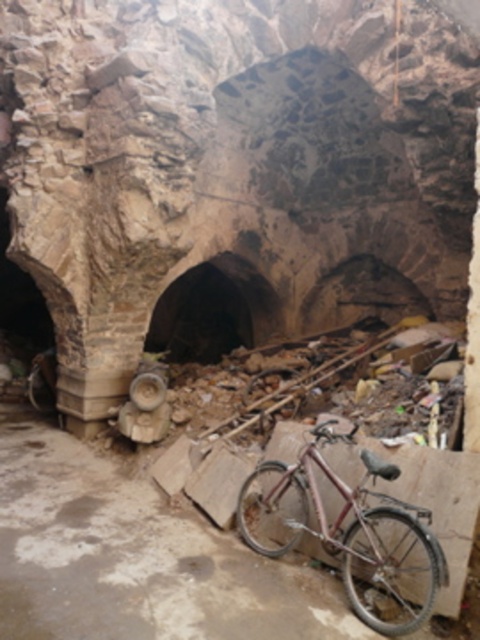
How distant is rusty metal bicycle at center from brown stone tunnel at center?

A distance of 18.81 feet exists between rusty metal bicycle at center and brown stone tunnel at center.

Locate an element on the screen. rusty metal bicycle at center is located at coordinates (136, 557).

Which is in front, point (58, 486) or point (190, 360)?

Point (58, 486) is more forward.

What are the coordinates of `rusty metal bicycle at center` in the screenshot? It's located at (136, 557).

Does rusty metal bicycle at center appear over rusty metallic bicycle at center?

Actually, rusty metal bicycle at center is below rusty metallic bicycle at center.

Can you confirm if rusty metal bicycle at center is positioned to the right of rusty metallic bicycle at center?

No, rusty metal bicycle at center is not to the right of rusty metallic bicycle at center.

Identify the location of rusty metal bicycle at center. (136, 557).

Find the location of a particular element. rusty metal bicycle at center is located at coordinates (136, 557).

Is rusty metallic bicycle at center shorter than brown stone tunnel at center?

Yes.

Which is in front, point (328, 476) or point (176, 282)?

Positioned in front is point (328, 476).

Does point (247, 525) come closer to viewer compared to point (178, 301)?

Yes.

Where is `rusty metallic bicycle at center`? Image resolution: width=480 pixels, height=640 pixels. rusty metallic bicycle at center is located at coordinates (355, 534).